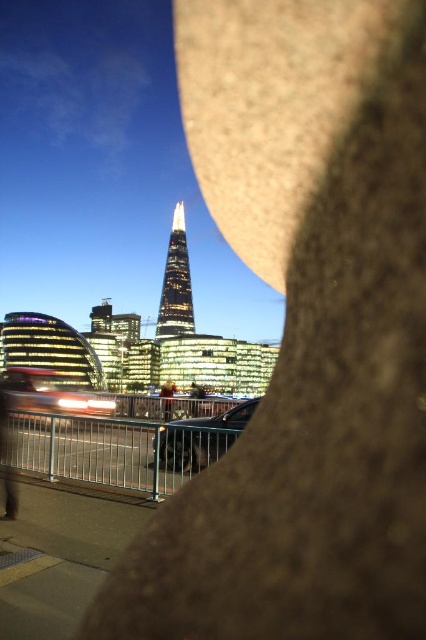
You are a drone operator planning to fly a drone from your current position to take aerial shots of the glassy reflective tower at center. The drone has a maximum flight range of 150 meters. Based on the scene, will the drone be able to reach the tower without exceeding its range?

The distance of glassy reflective tower at center from viewer is 160.86 meters, which exceeds the drone maximum flight range of 150 meters. The drone cannot reach the tower without exceeding its range.

You are a photographer standing in the city square and want to take a photo of both the glassy reflective tower at center and the light brown leather jacket at center. Which object will appear larger in your photo?

The glassy reflective tower at center is taller than the light brown leather jacket at center, so it will appear larger in the photo.

You are a drone operator tasked with flying a drone from the glassy reflective tower at center to the light brown leather jacket at center. The drone has a maximum flight range of 45 meters. Can the drone successfully complete this mission without needing to recharge?

The distance between the glassy reflective tower at center and the light brown leather jacket at center is 44.59 meters, which is within the drone operator drone maximum flight range of 45 meters. Therefore, the drone can successfully complete the mission without needing to recharge.